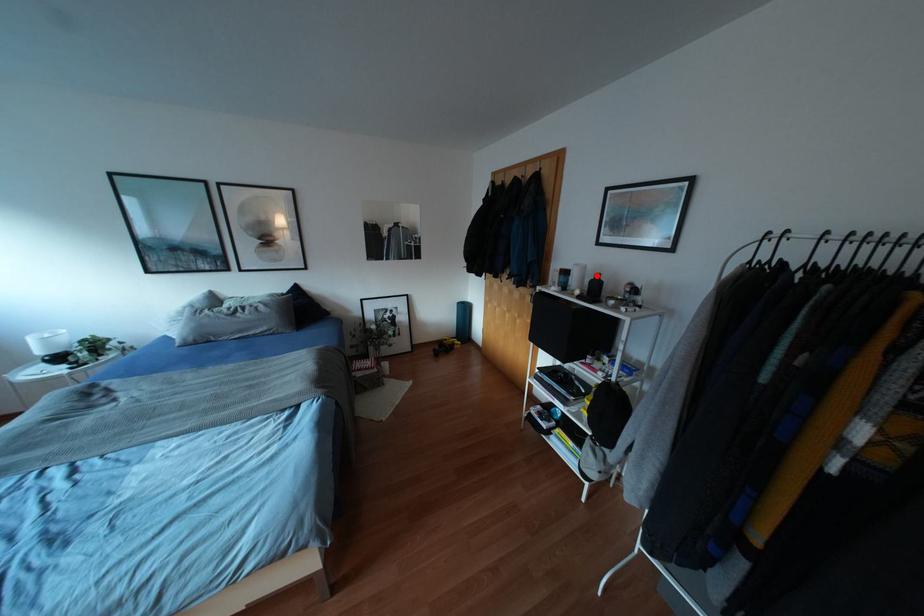
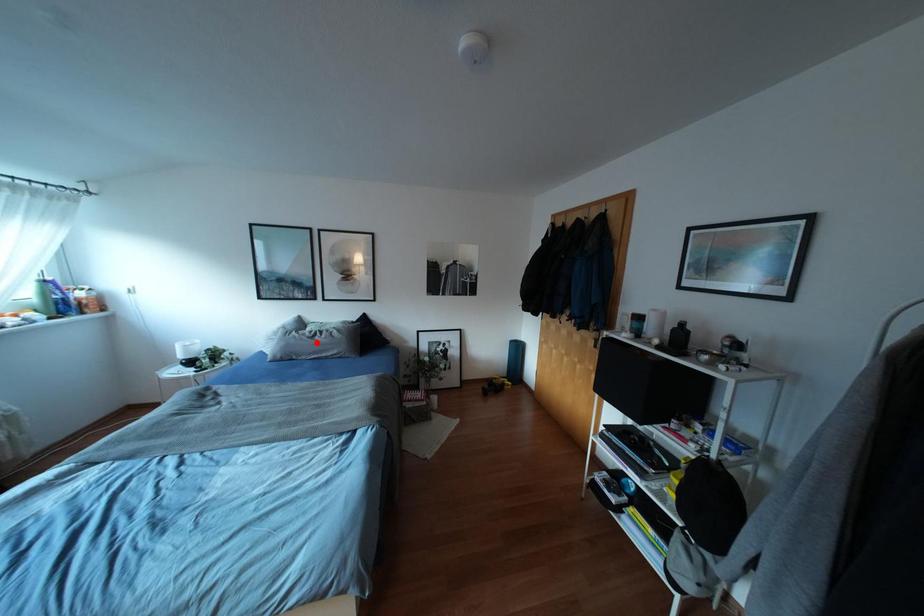
I am providing you with two images of the same scene from different viewpoints. A red point is marked on the first image and another point is marked on the second image. Are the points marked in image1 and image2 representing the same 3D position?

No